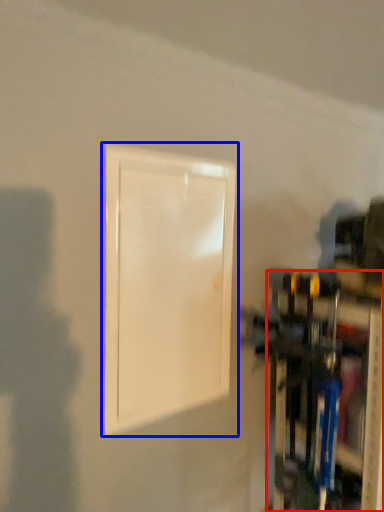
Question: Which of the following is the farthest to the observer, shelf (highlighted by a red box) or door (highlighted by a blue box)?

Choices:
 (A) shelf
 (B) door

Answer: (A)